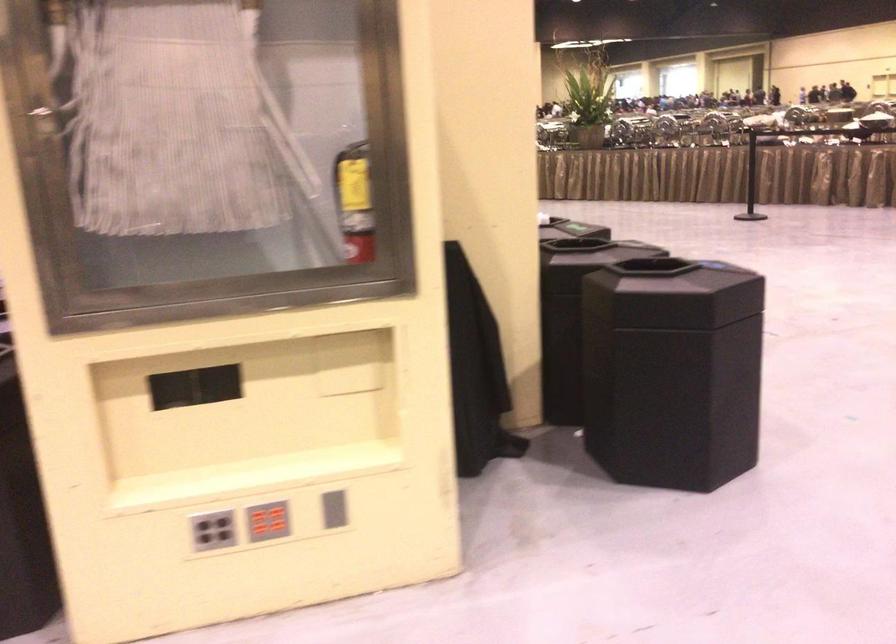
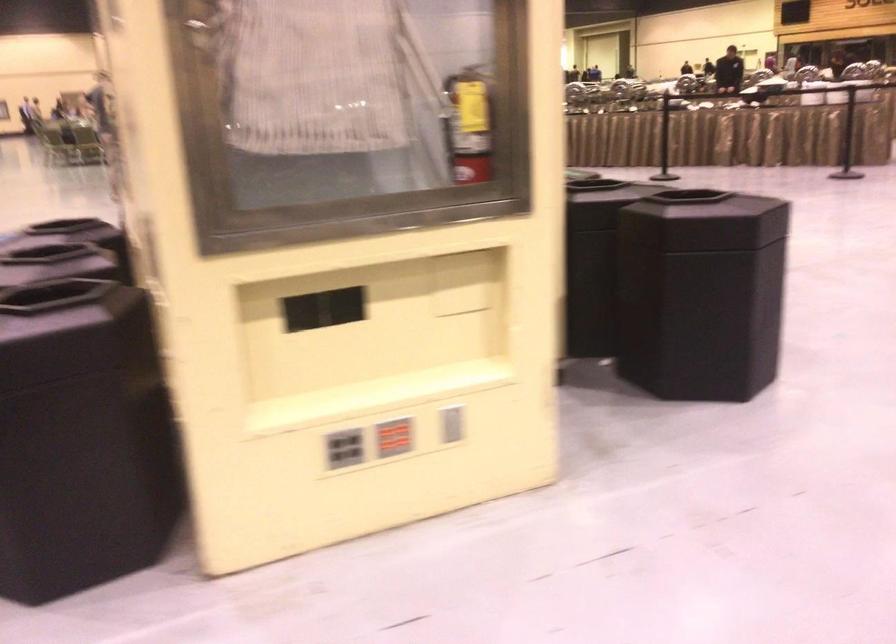
Question: The images are taken continuously from a first-person perspective. In which direction is your viewpoint rotating?

Choices:
 (A) Left
 (B) Right
 (C) Up
 (D) Down

Answer: (B)